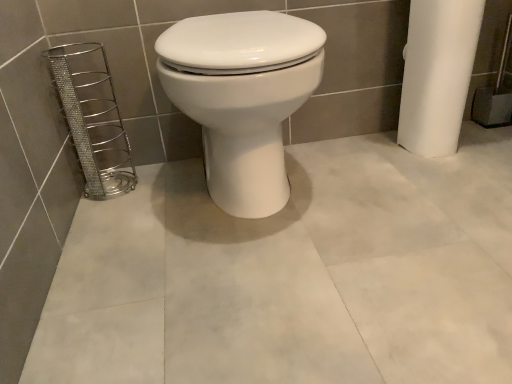
Question: Is white glossy toilet at center oriented away from silver metallic wire basket at left?

Choices:
 (A) yes
 (B) no

Answer: (B)

Question: Is white glossy toilet at center wider than silver metallic wire basket at left?

Choices:
 (A) yes
 (B) no

Answer: (A)

Question: Is white glossy toilet at center to the left of silver metallic wire basket at left from the viewer's perspective?

Choices:
 (A) yes
 (B) no

Answer: (B)

Question: Could you tell me if white glossy toilet at center is turned towards silver metallic wire basket at left?

Choices:
 (A) yes
 (B) no

Answer: (B)

Question: Considering the relative sizes of white glossy toilet at center and silver metallic wire basket at left in the image provided, is white glossy toilet at center shorter than silver metallic wire basket at left?

Choices:
 (A) no
 (B) yes

Answer: (A)

Question: Is white glossy toilet at center thinner than silver metallic wire basket at left?

Choices:
 (A) yes
 (B) no

Answer: (B)

Question: Considering the relative positions of silver metallic wire basket at left and white glossy toilet at center in the image provided, is silver metallic wire basket at left to the right of white glossy toilet at center from the viewer's perspective?

Choices:
 (A) yes
 (B) no

Answer: (B)

Question: Is silver metallic wire basket at left positioned beyond the bounds of white glossy toilet at center?

Choices:
 (A) no
 (B) yes

Answer: (B)

Question: From the image's perspective, is silver metallic wire basket at left located beneath white glossy toilet at center?

Choices:
 (A) no
 (B) yes

Answer: (B)

Question: Is silver metallic wire basket at left positioned with its back to white glossy toilet at center?

Choices:
 (A) yes
 (B) no

Answer: (B)

Question: Can you confirm if silver metallic wire basket at left is taller than white glossy toilet at center?

Choices:
 (A) no
 (B) yes

Answer: (A)

Question: Does silver metallic wire basket at left have a lesser width compared to white glossy toilet at center?

Choices:
 (A) no
 (B) yes

Answer: (B)

Question: In terms of width, does silver metallic wire basket at left look wider or thinner when compared to white glossy toilet at center?

Choices:
 (A) thin
 (B) wide

Answer: (A)